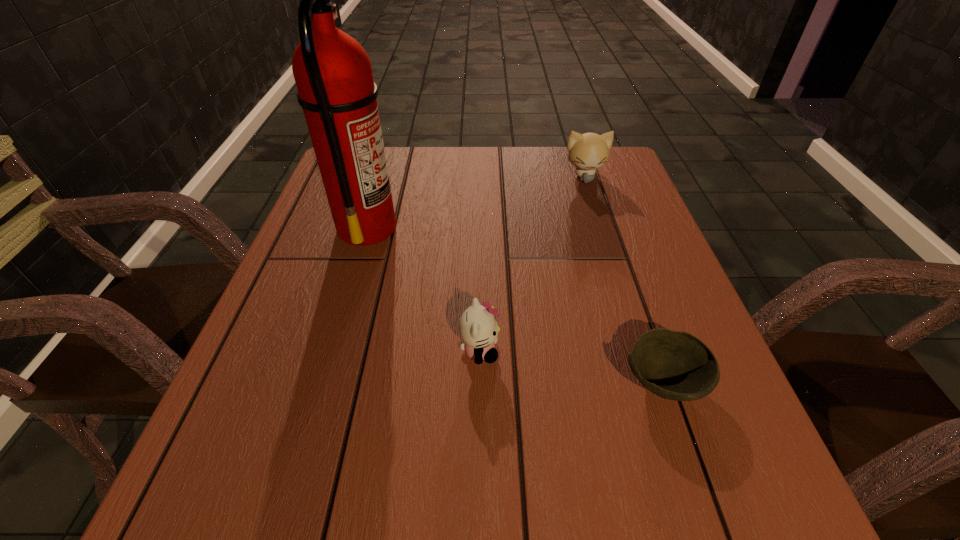
This screenshot has width=960, height=540. Identify the location of free spot that satisfies the following two spatial constraints: 1. on the face of the farther kitten; 2. on the side of the fire extinguisher near the handle. (601, 227).

The width and height of the screenshot is (960, 540). What are the coordinates of `free space that satisfies the following two spatial constraints: 1. on the back side of the shortest object; 2. on the side of the tallest object near the handle` in the screenshot? It's located at (610, 227).